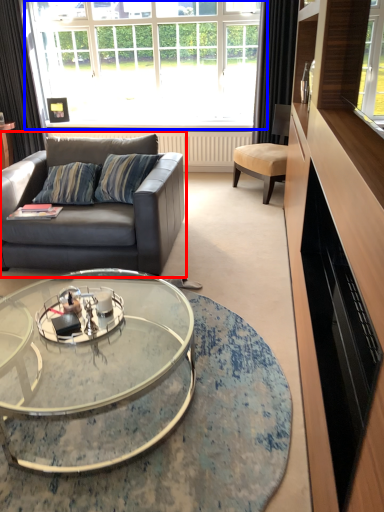
Question: Among these objects, which one is nearest to the camera, studio couch (highlighted by a red box) or window (highlighted by a blue box)?

Choices:
 (A) studio couch
 (B) window

Answer: (A)